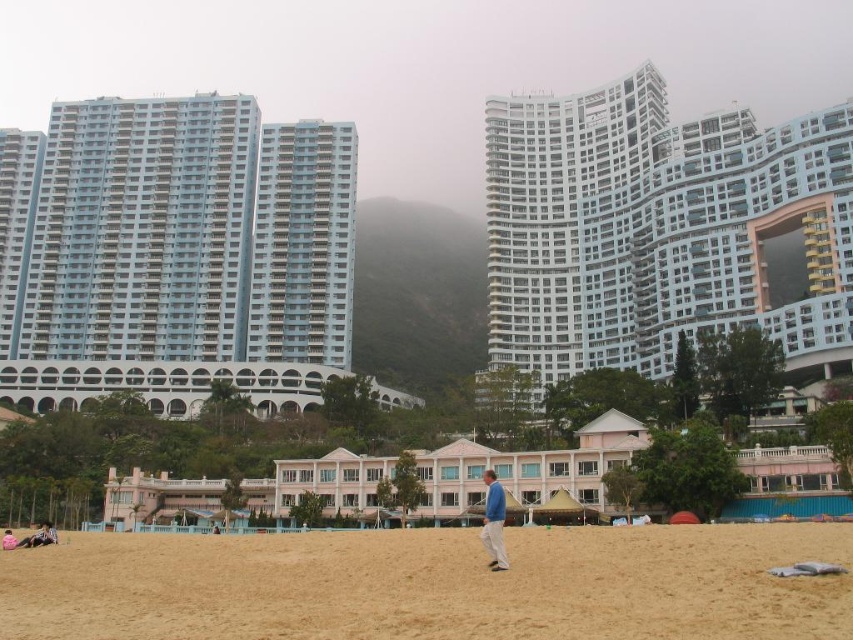
Question: Which of these objects is positioned closest to the white glass building at upper right?

Choices:
 (A) brown sandy beach at lower center
 (B) blue fabric jacket at center
 (C) light blue fabric at lower left
 (D) light blue glass building at left

Answer: (D)

Question: Where is matte black surfboard at lower left located in relation to light blue fabric at lower left in the image?

Choices:
 (A) right
 (B) left

Answer: (B)

Question: Is light blue glass building at left positioned at the back of blue fabric jacket at center?

Choices:
 (A) yes
 (B) no

Answer: (A)

Question: Can you confirm if brown sandy beach at lower center is bigger than light blue fabric at lower left?

Choices:
 (A) no
 (B) yes

Answer: (B)

Question: Which point is closer to the camera?

Choices:
 (A) white glass building at upper right
 (B) light blue fabric at lower left
 (C) light blue glass building at left
 (D) matte black surfboard at lower left

Answer: (B)

Question: Which point is farther from the camera taking this photo?

Choices:
 (A) (555, 369)
 (B) (9, 547)
 (C) (53, 536)
 (D) (503, 557)

Answer: (A)